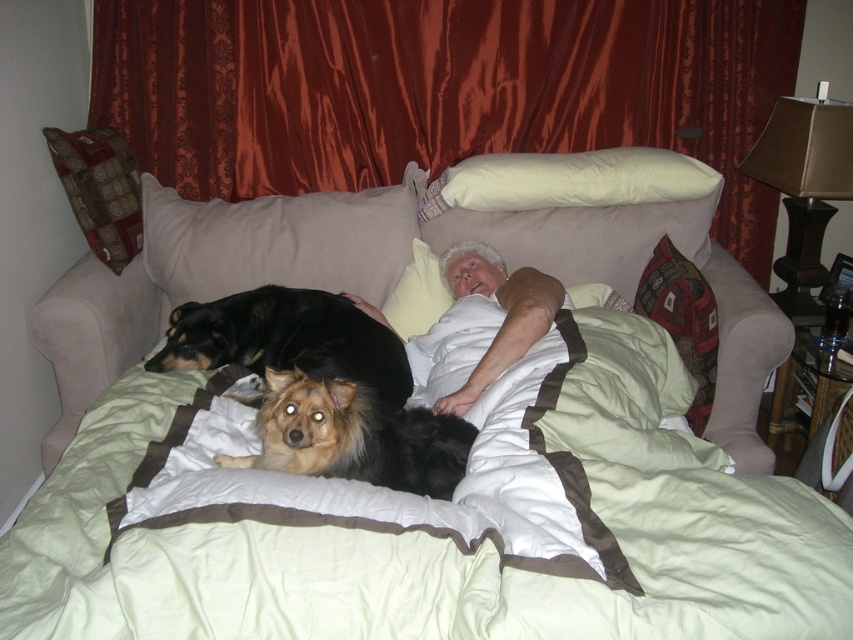
In order to click on green cotton blanket at center in this screenshot , I will do `click(431, 520)`.

Does green cotton blanket at center have a lesser height compared to white soft pillow at upper center?

No.

Which is behind, point (688, 502) or point (502, 180)?

Positioned behind is point (502, 180).

This screenshot has width=853, height=640. In order to click on green cotton blanket at center in this screenshot , I will do `click(431, 520)`.

Is fuzzy brown dog at center smaller than patterned fabric pillow at upper left?

No, fuzzy brown dog at center is not smaller than patterned fabric pillow at upper left.

Does point (344, 412) come closer to viewer compared to point (80, 216)?

Yes.

I want to click on fuzzy brown dog at center, so click(x=354, y=436).

Can you confirm if green cotton blanket at center is positioned below fuzzy brown dog at center?

Yes.

Who is lower down, green cotton blanket at center or fuzzy brown dog at center?

green cotton blanket at center

Does point (194, 388) come farther from viewer compared to point (350, 429)?

Yes, it is behind point (350, 429).

Locate an element on the screen. The width and height of the screenshot is (853, 640). green cotton blanket at center is located at coordinates (431, 520).